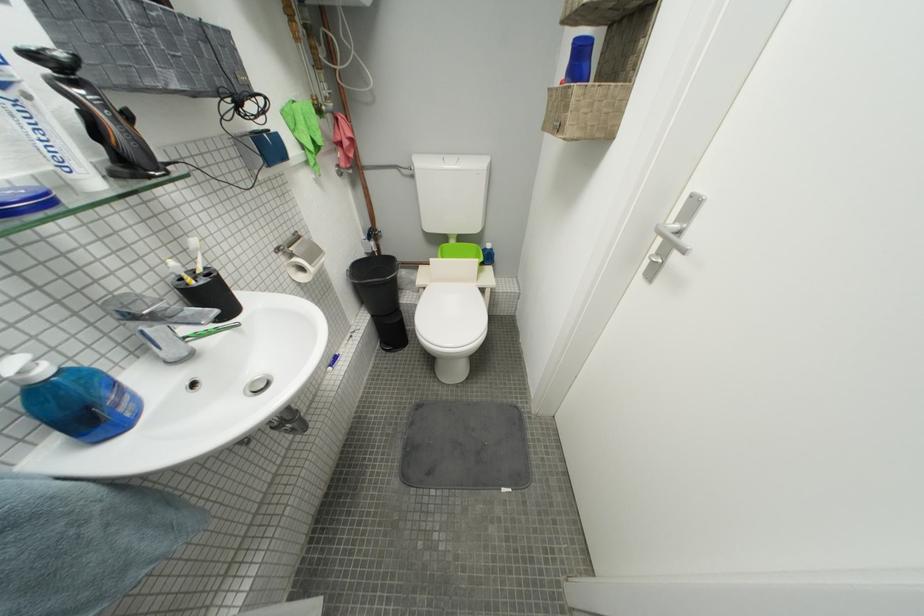
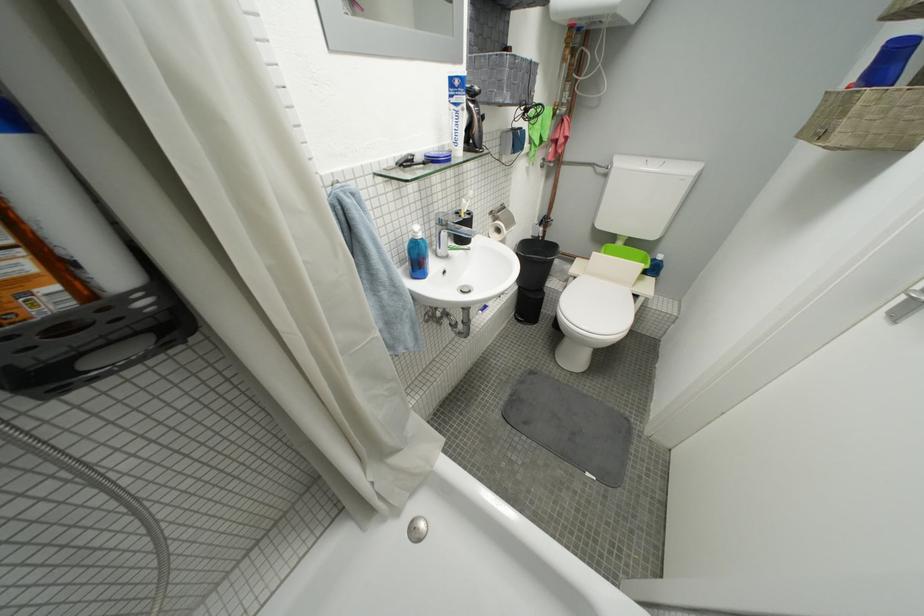
Find the pixel in the second image that matches point (433, 291) in the first image.

(584, 281)